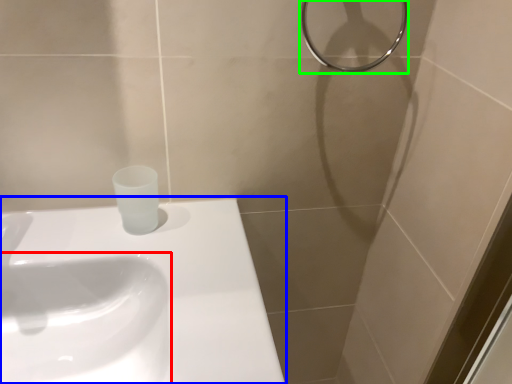
Question: Which object is the farthest from sink (highlighted by a red box)? Choose among these: sink (highlighted by a blue box) or shower (highlighted by a green box).

Choices:
 (A) sink
 (B) shower

Answer: (B)